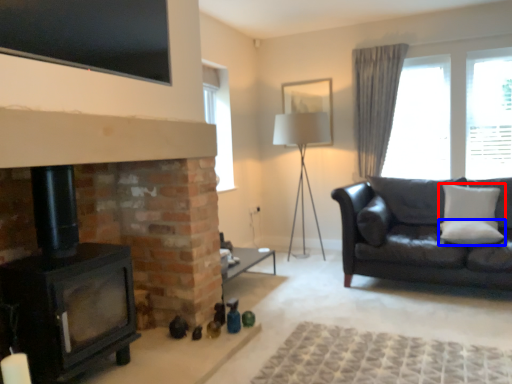
Question: Which point is closer to the camera, pillow (highlighted by a red box) or pillow (highlighted by a blue box)?

Choices:
 (A) pillow
 (B) pillow

Answer: (B)